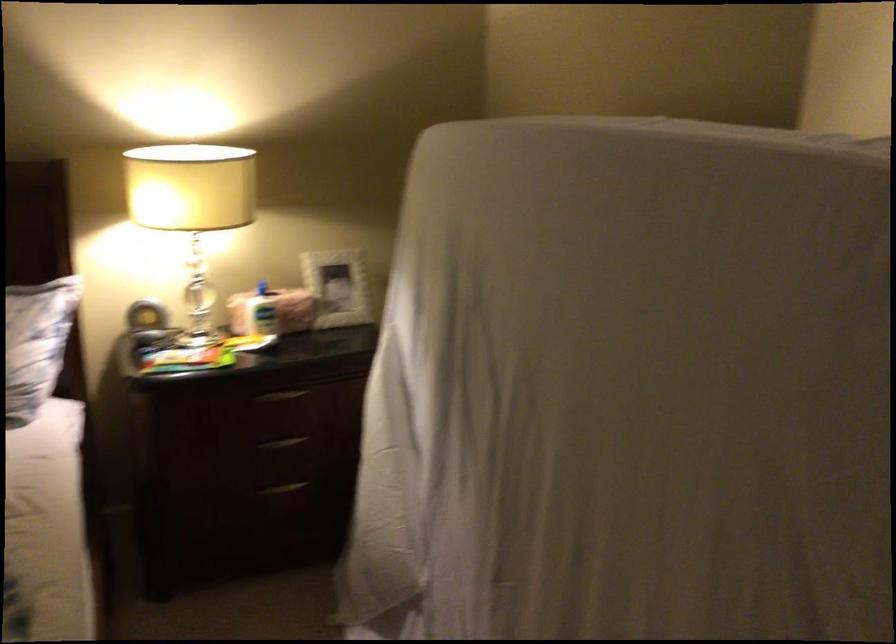
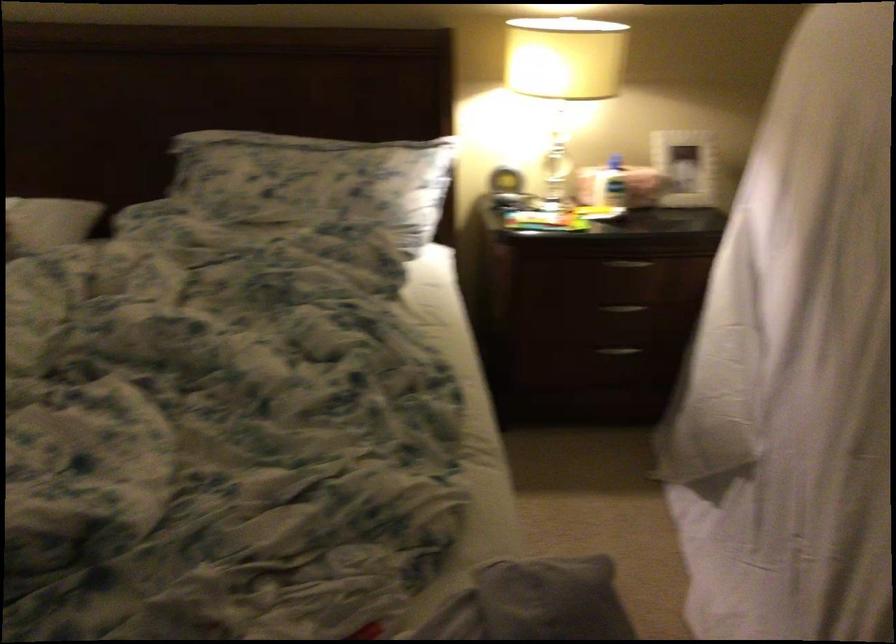
Where in the second image is the point corresponding to pixel 282 498 from the first image?

(616, 355)